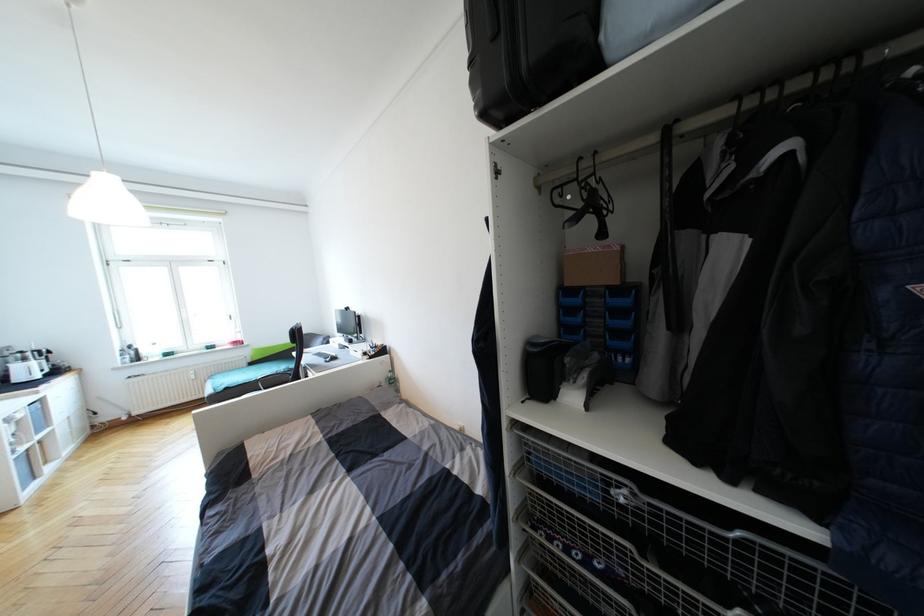
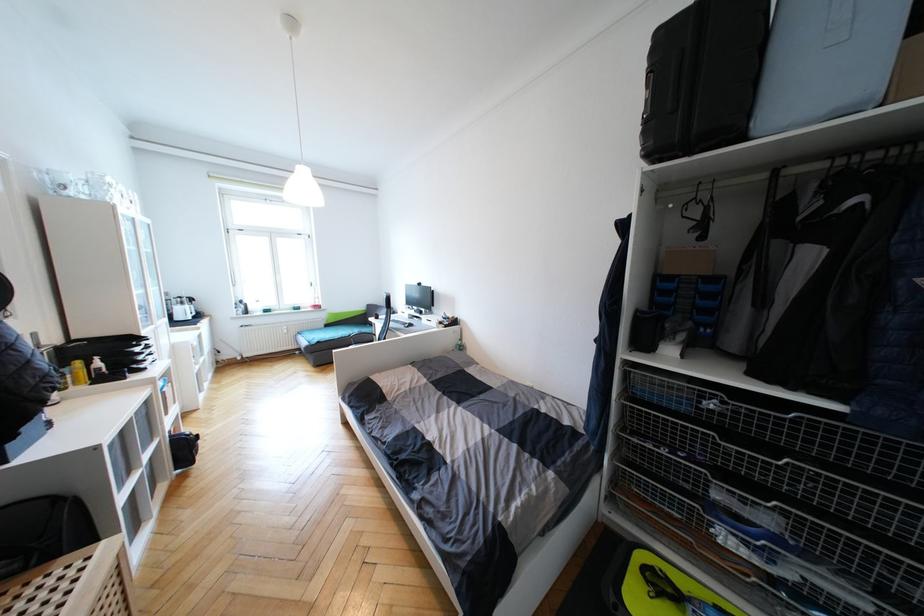
Find the pixel in the second image that matches (475,65) in the first image.

(649, 123)